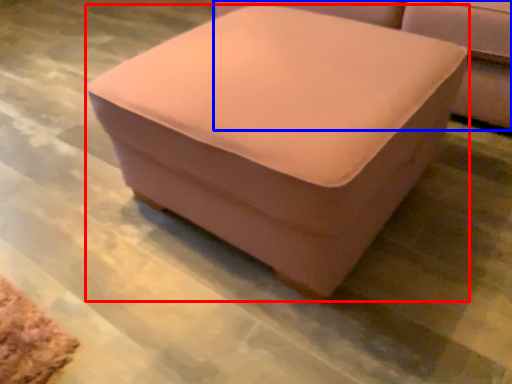
Question: Which object appears closest to the camera in this image, furniture (highlighted by a red box) or studio couch (highlighted by a blue box)?

Choices:
 (A) furniture
 (B) studio couch

Answer: (A)